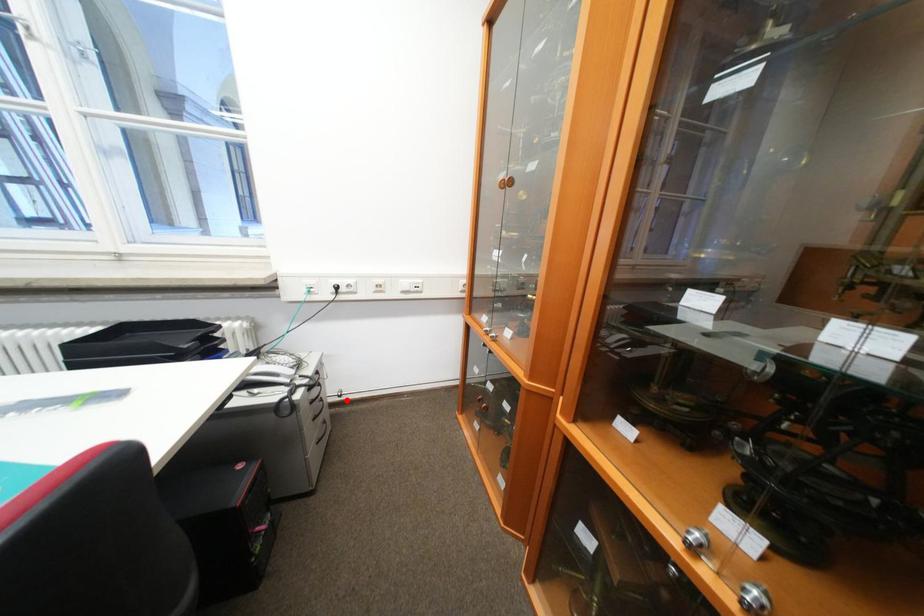
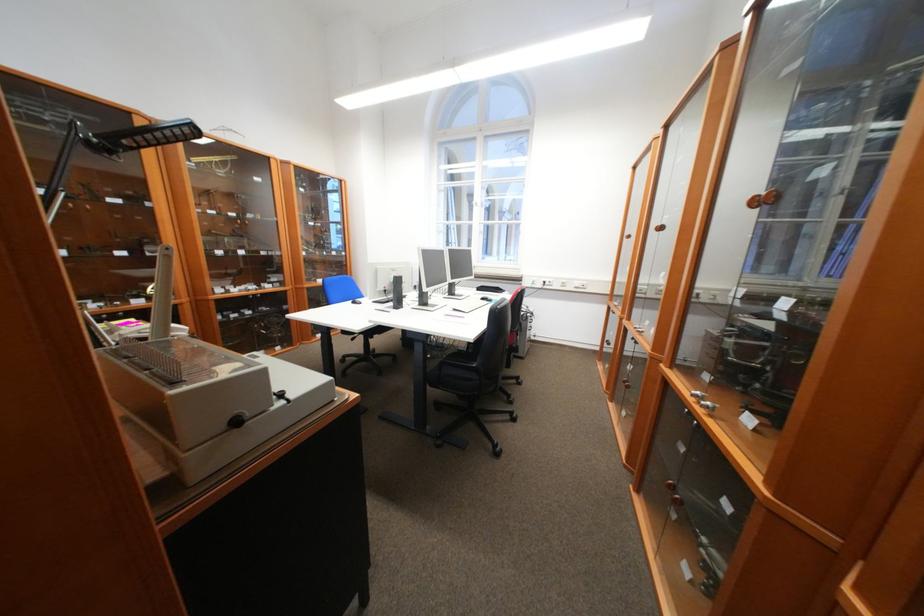
The point at the highlighted location is marked in the first image. Where is the corresponding point in the second image?

(541, 339)